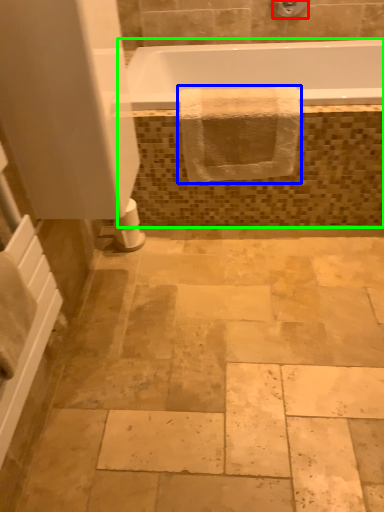
Question: Which object is positioned farthest from shower (highlighted by a red box)? Select from bath towel (highlighted by a blue box) and bath (highlighted by a green box).

Choices:
 (A) bath towel
 (B) bath

Answer: (B)